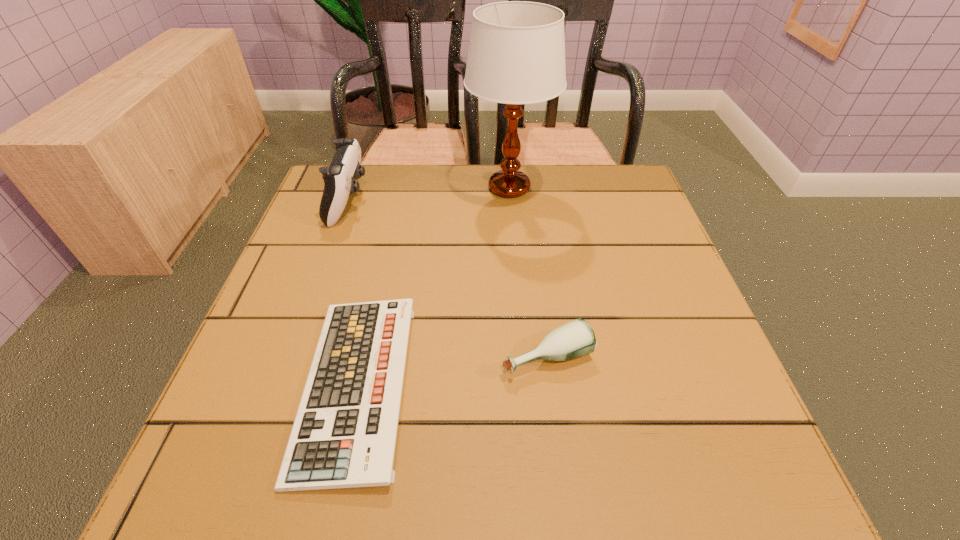
What are the coordinates of `vacant area at the near left corner` in the screenshot? It's located at (201, 449).

In the image, there is a desktop. At what (x,y) coordinates should I click in order to perform the action: click on vacant space at the far right corner. Please return your answer as a coordinate pair (x, y). This screenshot has height=540, width=960. Looking at the image, I should click on (585, 192).

Image resolution: width=960 pixels, height=540 pixels. In order to click on vacant area that lies between the control and the tallest object in this screenshot , I will do 429,195.

Where is `free space between the computer keyboard and the control`? free space between the computer keyboard and the control is located at coordinates (352, 294).

Find the location of a particular element. This screenshot has height=540, width=960. vacant space that's between the second tallest object and the table lamp is located at coordinates (429, 195).

Identify the location of free space between the control and the tallest object. (429, 195).

You are a GUI agent. You are given a task and a screenshot of the screen. Output one action in this format:
    pyautogui.click(x=<x>, y=<y>)
    Task: Click on the free space that is in between the bottle and the second tallest object
    The width and height of the screenshot is (960, 540).
    Given the screenshot: What is the action you would take?
    pyautogui.click(x=447, y=279)

Identify the location of free space that is in between the table lamp and the computer keyboard. The image size is (960, 540). (433, 287).

Find the location of a particular element. This screenshot has width=960, height=540. blank region between the control and the tallest object is located at coordinates (429, 195).

Identify the location of vacant space that is in between the computer keyboard and the bottle. The width and height of the screenshot is (960, 540). point(451,370).